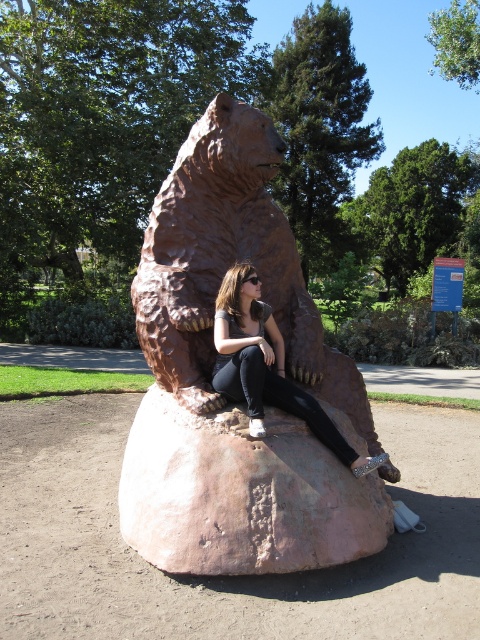
Question: Which point is closer to the camera?

Choices:
 (A) (169, 433)
 (B) (273, 401)
 (C) (188, 284)

Answer: (A)

Question: Considering the real-world distances, which object is farthest from the matte bronze bear at center?

Choices:
 (A) pink stone boulder at center
 (B) brown stone bear at center

Answer: (A)

Question: Does pink stone boulder at center appear on the left side of matte bronze bear at center?

Choices:
 (A) no
 (B) yes

Answer: (B)

Question: Which point appears closest to the camera in this image?

Choices:
 (A) (339, 550)
 (B) (214, 422)
 (C) (229, 275)

Answer: (A)

Question: Does brown stone bear at center appear under matte bronze bear at center?

Choices:
 (A) no
 (B) yes

Answer: (A)

Question: Is the position of brown stone bear at center less distant than that of pink stone boulder at center?

Choices:
 (A) no
 (B) yes

Answer: (A)